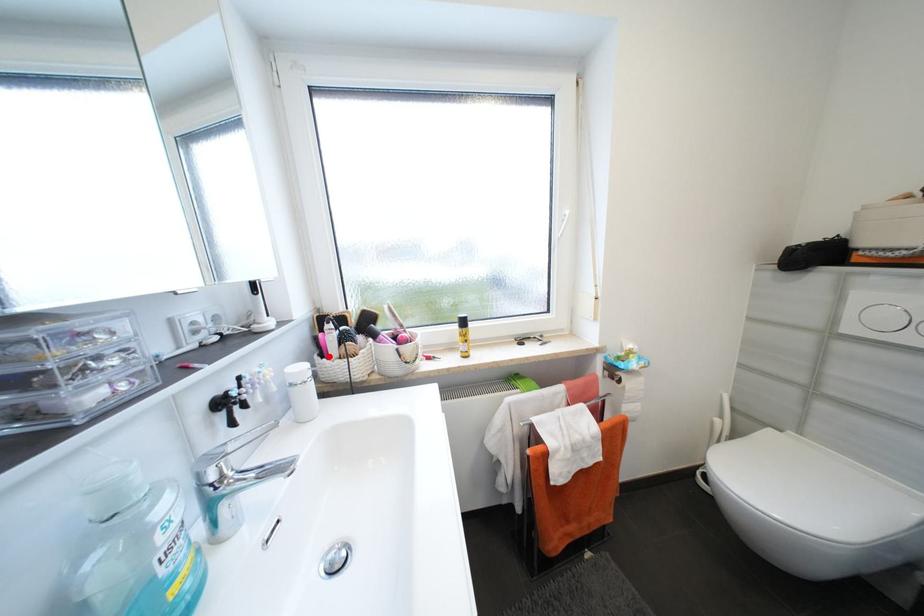
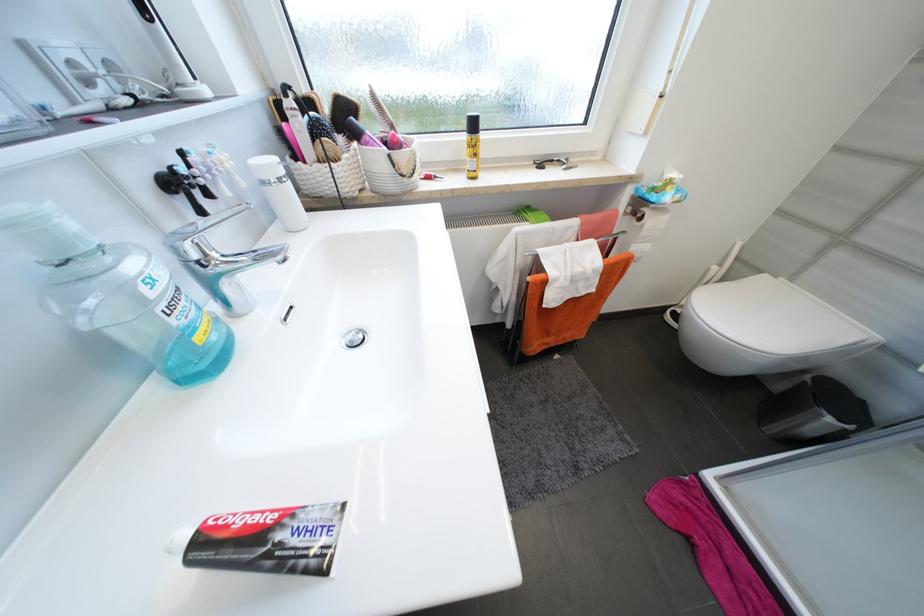
The point at the highlighted location is marked in the first image. Where is the corresponding point in the second image?

(304, 158)